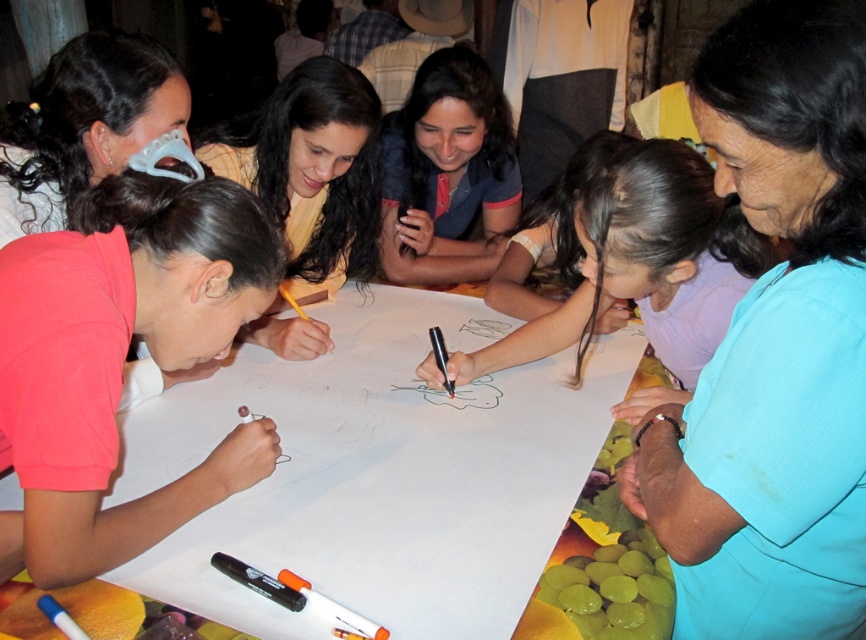
You are standing at the edge of the table where the collaborative drawing activity is happening. You see the white paper at center and the smooth purple shirt at center. Which object is closer to the edge of the table?

The white paper at center is below the smooth purple shirt at center, so the smooth purple shirt at center is closer to the edge of the table.

You are an artist trying to place a matte plastic mask at upper left on the table. The table is represented by coordinates from 0 to 1 on both axes. Where exactly should you place it?

The matte plastic mask at upper left should be placed at coordinates point (83,124).

You are standing at the edge of the table and want to reach both the white paper at center and the smooth purple shirt at center. Which object is closer to your left hand?

The white paper at center is positioned on the left side of smooth purple shirt at center, so the white paper at center is closer to your left hand.